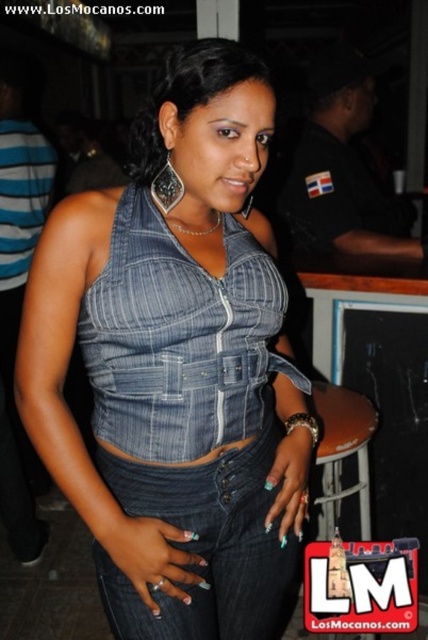
Question: Which of these objects is positioned closest to the denim at center?

Choices:
 (A) denim top at center
 (B) denim jeans at center
 (C) black uniform at upper center

Answer: (B)

Question: Which point is closer to the camera?

Choices:
 (A) black uniform at upper center
 (B) denim jeans at center
 (C) denim at center
 (D) denim top at center

Answer: (C)

Question: Can you confirm if denim at center is positioned to the right of black uniform at upper center?

Choices:
 (A) yes
 (B) no

Answer: (B)

Question: Does denim at center have a larger size compared to denim jeans at center?

Choices:
 (A) no
 (B) yes

Answer: (B)

Question: Is denim at center below denim top at center?

Choices:
 (A) yes
 (B) no

Answer: (A)

Question: Which point appears farthest from the camera in this image?

Choices:
 (A) (353, 186)
 (B) (216, 522)

Answer: (A)